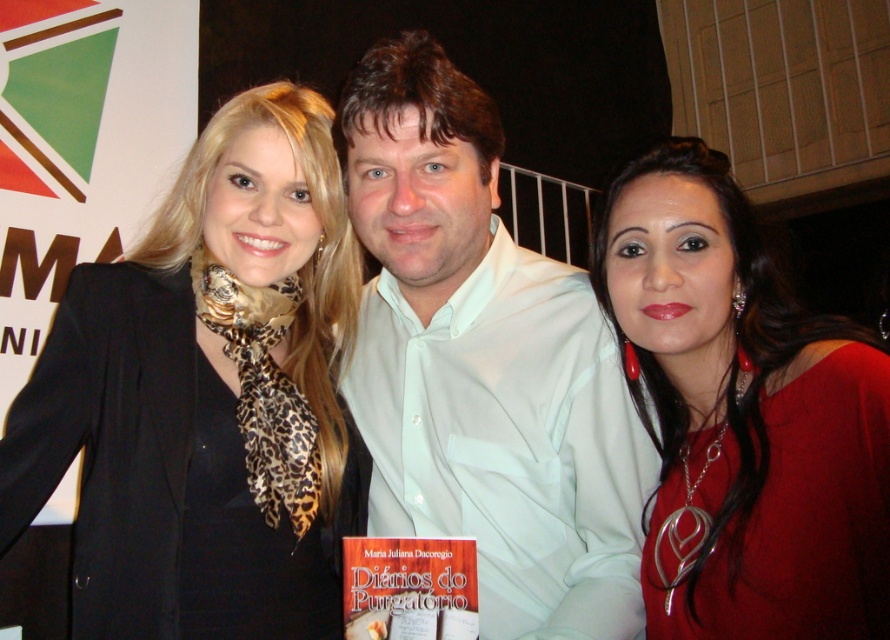
You are a photographer adjusting the lighting for a group photo. You notice the white cotton shirt at center and the matte red blouse at center. Which clothing item should you focus on adjusting the lighting for to ensure it doesn not cast a shadow on the taller object?

The white cotton shirt at center is much taller than the matte red blouse at center, so you should focus on adjusting the lighting for the white cotton shirt at center to prevent it from casting a shadow on the shorter matte red blouse at center.

You are organizing a photo shoot and need to ensure the two central participants are positioned correctly. According to the image, which participant is positioned to the left of the other between the white cotton shirt at center and the matte red blouse at center?

The white cotton shirt at center is positioned to the left of the matte red blouse at center.